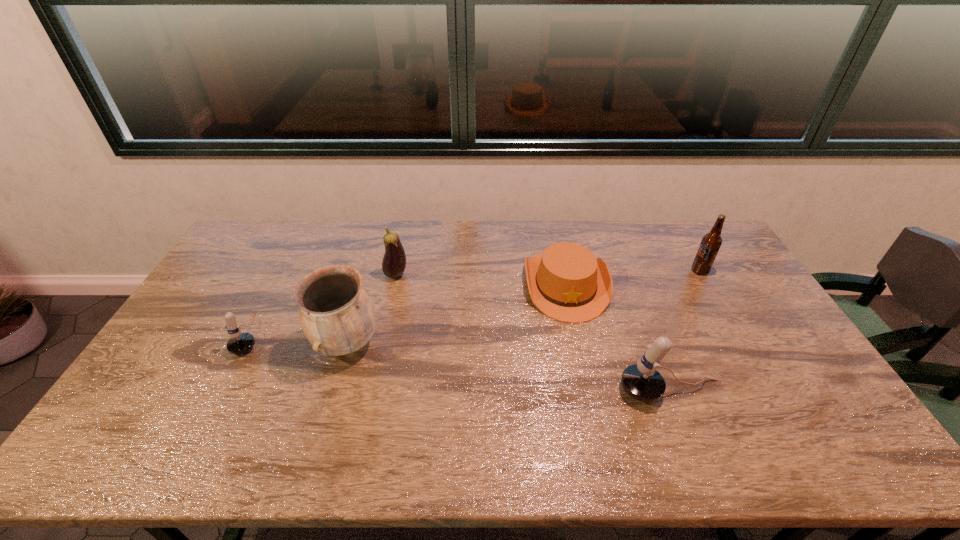
Locate an element on the screen. This screenshot has width=960, height=540. free space at the near edge of the desktop is located at coordinates (485, 397).

At what (x,y) coordinates should I click in order to perform the action: click on blank space at the right edge of the desktop. Please return your answer as a coordinate pair (x, y). Looking at the image, I should click on (729, 313).

Find the location of a particular element. The height and width of the screenshot is (540, 960). vacant space at the far left corner of the desktop is located at coordinates (233, 248).

Where is `vacant region at the far right corner of the desktop`? The height and width of the screenshot is (540, 960). vacant region at the far right corner of the desktop is located at coordinates (698, 247).

This screenshot has width=960, height=540. I want to click on free space between the rightmost object and the urn, so click(523, 307).

The image size is (960, 540). What are the coordinates of `free space between the leftmost object and the beer bottle` in the screenshot? It's located at (475, 303).

You are a GUI agent. You are given a task and a screenshot of the screen. Output one action in this format:
    pyautogui.click(x=<x>, y=<y>)
    Task: Click on the blank region between the rightmost object and the cowboy hat
    The height and width of the screenshot is (540, 960).
    Given the screenshot: What is the action you would take?
    pyautogui.click(x=633, y=278)

Locate an element on the screen. The width and height of the screenshot is (960, 540). free area in between the urn and the nearer microphone is located at coordinates (509, 367).

This screenshot has width=960, height=540. In order to click on free space between the rightmost object and the shortest object in this screenshot , I will do `click(633, 278)`.

This screenshot has height=540, width=960. In order to click on vacant area that lies between the taller microphone and the rightmost object in this screenshot , I will do `click(685, 330)`.